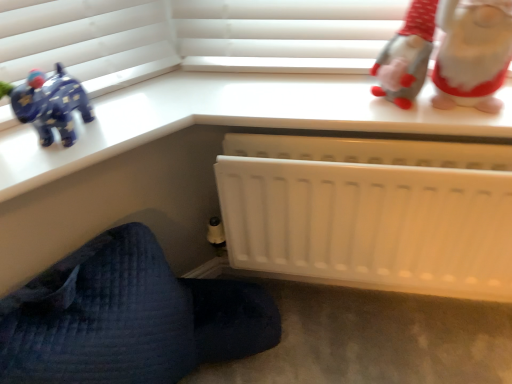
Question: Considering their positions, is white plastic radiator at lower center located in front of or behind white plush gnome at upper right?

Choices:
 (A) front
 (B) behind

Answer: (B)

Question: From the image's perspective, relative to white plush gnome at upper right, is white plastic radiator at lower center above or below?

Choices:
 (A) above
 (B) below

Answer: (B)

Question: Which of these objects is positioned farthest from the white matte radiator at lower right?

Choices:
 (A) white plastic radiator at lower center
 (B) white plush gnome at upper right

Answer: (B)

Question: Based on their relative distances, which object is nearer to the white plush gnome at upper right?

Choices:
 (A) white matte radiator at lower right
 (B) white plastic radiator at lower center

Answer: (B)